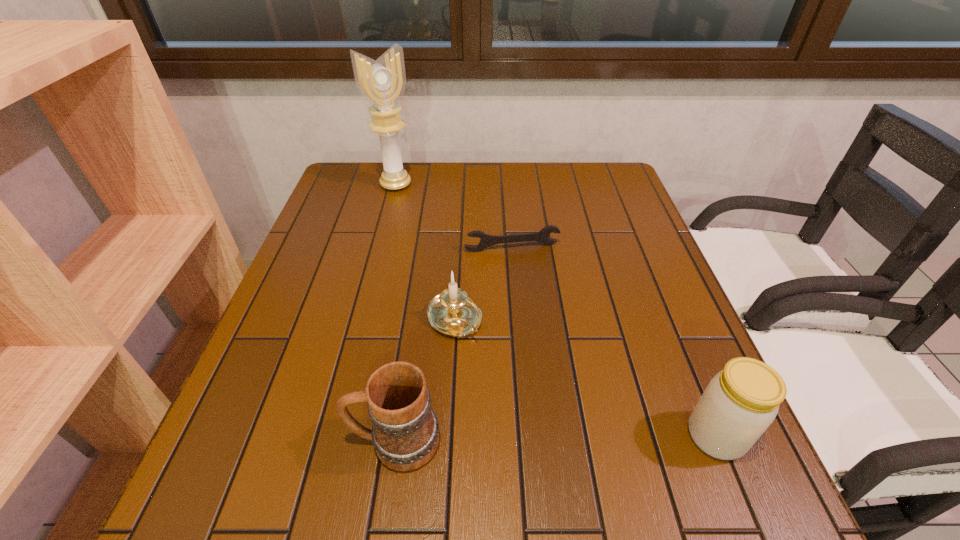
At what (x,y) coordinates should I click in order to perform the action: click on empty location between the farthest object and the rightmost object. Please return your answer as a coordinate pair (x, y). Looking at the image, I should click on click(x=556, y=310).

Image resolution: width=960 pixels, height=540 pixels. What are the coordinates of `free area in between the mug and the second farthest object` in the screenshot? It's located at (453, 345).

You are a GUI agent. You are given a task and a screenshot of the screen. Output one action in this format:
    pyautogui.click(x=<x>, y=<y>)
    Task: Click on the vacant area between the rightmost object and the award
    The image size is (960, 540).
    Given the screenshot: What is the action you would take?
    pyautogui.click(x=556, y=310)

Locate which object is the second closest to the farthest object. Please provide its 2D coordinates. Your answer should be formatted as a tuple, i.e. [(x, y)], where the tuple contains the x and y coordinates of a point satisfying the conditions above.

[(453, 313)]

Identify which object is located as the nearest to the tallest object. Please provide its 2D coordinates. Your answer should be formatted as a tuple, i.e. [(x, y)], where the tuple contains the x and y coordinates of a point satisfying the conditions above.

[(486, 240)]

I want to click on blank area in the image that satisfies the following two spatial constraints: 1. on the front side of the tallest object; 2. on the right side of the rightmost object, so click(x=330, y=436).

The image size is (960, 540). In order to click on free region that satisfies the following two spatial constraints: 1. on the front side of the rightmost object; 2. on the right side of the wrench in this screenshot , I will do click(x=528, y=436).

Identify the location of free spot that satisfies the following two spatial constraints: 1. on the front side of the rightmost object; 2. on the right side of the tallest object. (330, 436).